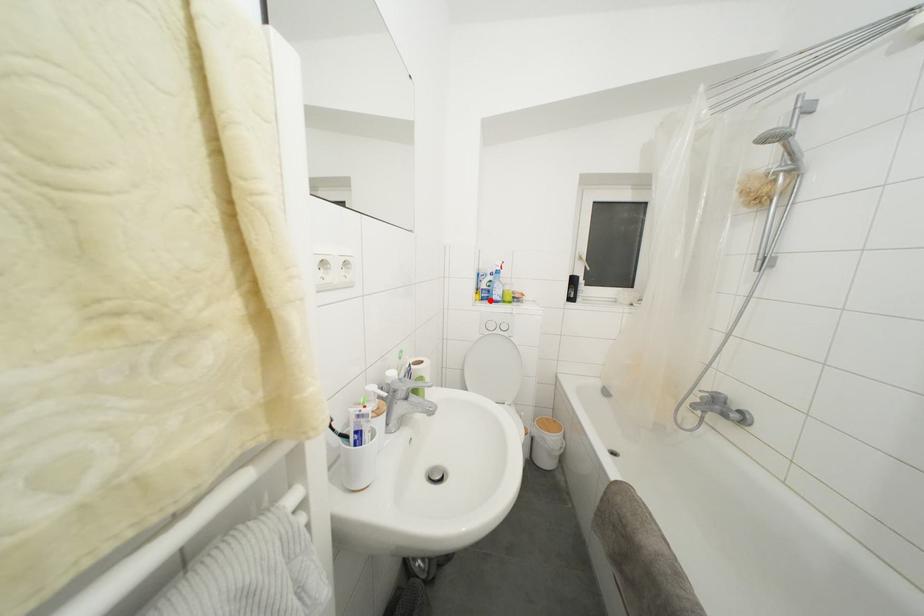
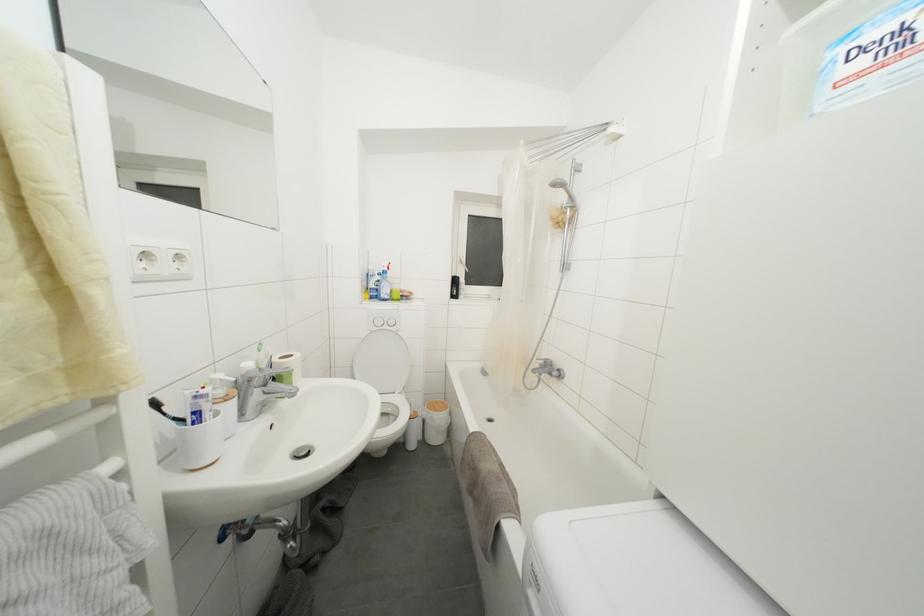
In the second image, find the point that corresponds to the highlighted location in the first image.

(379, 300)